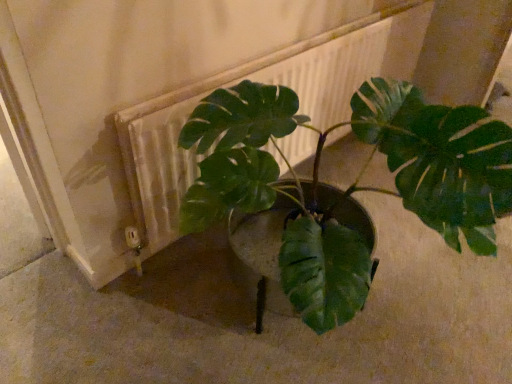
Question: Is white textured radiator at center at the left side of green matte plant at center?

Choices:
 (A) no
 (B) yes

Answer: (A)

Question: Considering the relative sizes of white textured radiator at center and green matte plant at center in the image provided, is white textured radiator at center smaller than green matte plant at center?

Choices:
 (A) no
 (B) yes

Answer: (B)

Question: Would you say white textured radiator at center is a long distance from green matte plant at center?

Choices:
 (A) no
 (B) yes

Answer: (A)

Question: Is white textured radiator at center surrounding green matte plant at center?

Choices:
 (A) yes
 (B) no

Answer: (B)

Question: From the image's perspective, is white textured radiator at center above green matte plant at center?

Choices:
 (A) no
 (B) yes

Answer: (B)

Question: Is white textured radiator at center wider than green matte plant at center?

Choices:
 (A) no
 (B) yes

Answer: (A)

Question: Does green matte plant at center come behind white textured radiator at center?

Choices:
 (A) no
 (B) yes

Answer: (A)

Question: Is green matte plant at center bigger than white textured radiator at center?

Choices:
 (A) no
 (B) yes

Answer: (B)

Question: Does green matte plant at center have a greater width compared to white textured radiator at center?

Choices:
 (A) no
 (B) yes

Answer: (B)

Question: Could you tell me if green matte plant at center is facing white textured radiator at center?

Choices:
 (A) no
 (B) yes

Answer: (A)

Question: Can you confirm if green matte plant at center is positioned to the right of white textured radiator at center?

Choices:
 (A) yes
 (B) no

Answer: (B)

Question: Does green matte plant at center have a lesser height compared to white textured radiator at center?

Choices:
 (A) no
 (B) yes

Answer: (A)

Question: Considering the positions of white textured radiator at center and green matte plant at center in the image, is white textured radiator at center taller or shorter than green matte plant at center?

Choices:
 (A) short
 (B) tall

Answer: (A)